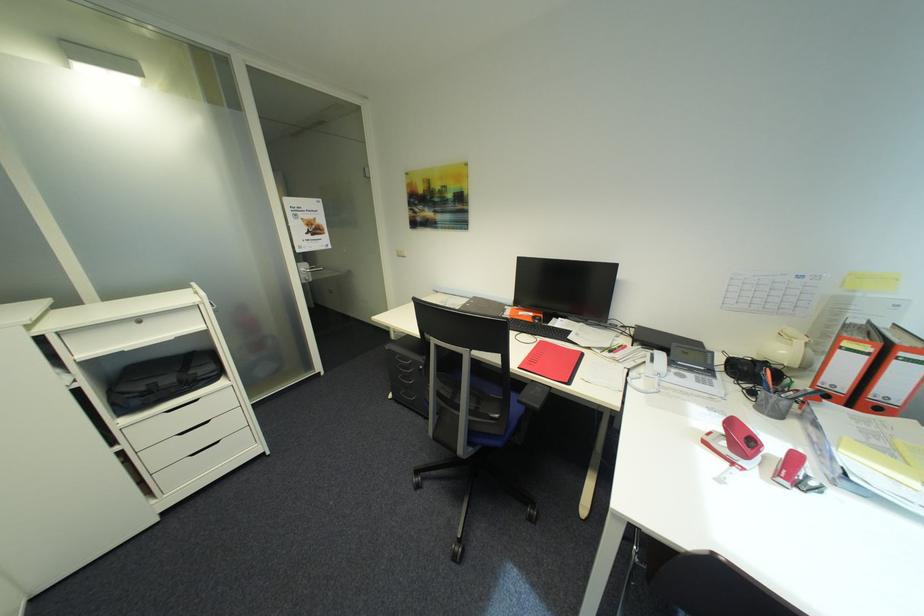
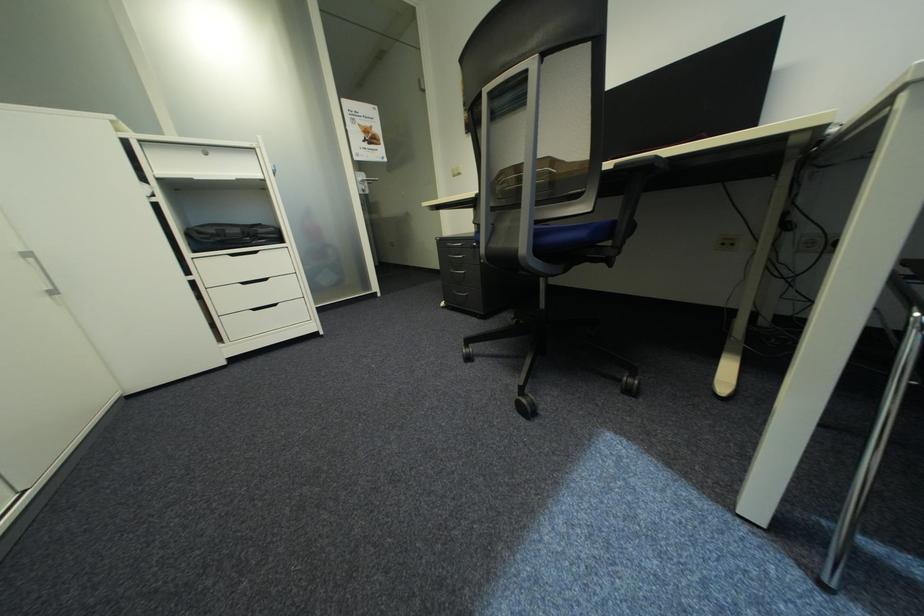
Question: I am providing you with two images of the same scene from different viewpoints. Which of the following objects are not visible in image2?

Choices:
 (A) red notebook
 (B) blue chair sitting surface
 (C) white drawer handle
 (D) red medal ribbon

Answer: (A)